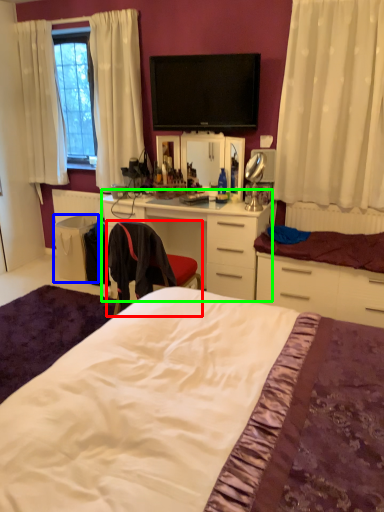
Question: Which is farther away from chair (highlighted by a red box)? trash bin/can (highlighted by a blue box) or desk (highlighted by a green box)?

Choices:
 (A) trash bin/can
 (B) desk

Answer: (A)